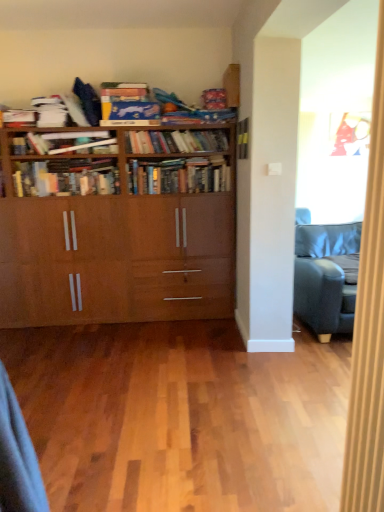
Question: Is hardcover books at center, the first book positioned from the bottom, thinner than matte black book at center, acting as the fourth book starting from the top?

Choices:
 (A) no
 (B) yes

Answer: (A)

Question: Is hardcover books at center, the first book positioned from the bottom, at the left side of matte black book at center, which is the third book in bottom-to-top order?

Choices:
 (A) yes
 (B) no

Answer: (A)

Question: From the image's perspective, is hardcover books at center, acting as the 6th book starting from the top, located beneath matte black book at center, acting as the fourth book starting from the top?

Choices:
 (A) yes
 (B) no

Answer: (A)

Question: From a real-world perspective, is hardcover books at center, acting as the 6th book starting from the top, physically below matte black book at center, which is the third book in bottom-to-top order?

Choices:
 (A) yes
 (B) no

Answer: (A)

Question: Considering the relative sizes of hardcover books at center, the first book positioned from the bottom, and matte black book at center, acting as the fourth book starting from the top, in the image provided, is hardcover books at center, the first book positioned from the bottom, taller than matte black book at center, acting as the fourth book starting from the top,?

Choices:
 (A) no
 (B) yes

Answer: (A)

Question: Is matte black book at center, which is the third book in bottom-to-top order, inside hardcover books at center, acting as the 6th book starting from the top?

Choices:
 (A) no
 (B) yes

Answer: (A)

Question: Is blue cardboard book at upper center, acting as the first book starting from the top, surrounded by hardcover books at center, the first book positioned from the bottom?

Choices:
 (A) no
 (B) yes

Answer: (A)

Question: Can you confirm if hardcover books at center, acting as the 6th book starting from the top, is shorter than blue cardboard book at upper center, acting as the first book starting from the top?

Choices:
 (A) yes
 (B) no

Answer: (A)

Question: From a real-world perspective, is hardcover books at center, the first book positioned from the bottom, on blue cardboard book at upper center, which ranks as the 6th book in bottom-to-top order?

Choices:
 (A) yes
 (B) no

Answer: (B)

Question: From the image's perspective, is hardcover books at center, acting as the 6th book starting from the top, above blue cardboard book at upper center, which ranks as the 6th book in bottom-to-top order?

Choices:
 (A) yes
 (B) no

Answer: (B)

Question: Considering the relative sizes of hardcover books at center, acting as the 6th book starting from the top, and blue cardboard book at upper center, which ranks as the 6th book in bottom-to-top order, in the image provided, is hardcover books at center, acting as the 6th book starting from the top, thinner than blue cardboard book at upper center, which ranks as the 6th book in bottom-to-top order,?

Choices:
 (A) no
 (B) yes

Answer: (B)

Question: Is hardcover books at center, the first book positioned from the bottom, outside blue cardboard book at upper center, acting as the first book starting from the top?

Choices:
 (A) yes
 (B) no

Answer: (A)

Question: Does hardcover books at center, acting as the 6th book starting from the top, come in front of wooden bookshelf at center, marked as the second book in a top-to-bottom arrangement?

Choices:
 (A) no
 (B) yes

Answer: (B)